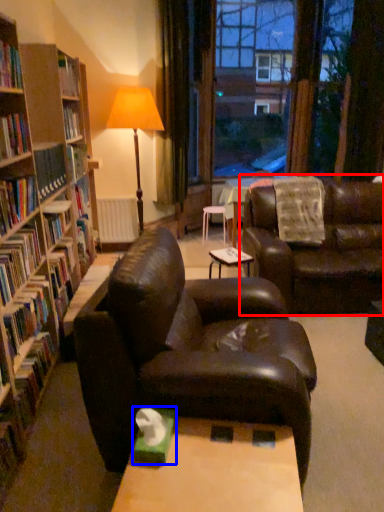
Question: Which object is further to the camera taking this photo, studio couch (highlighted by a red box) or paperback book (highlighted by a blue box)?

Choices:
 (A) studio couch
 (B) paperback book

Answer: (A)